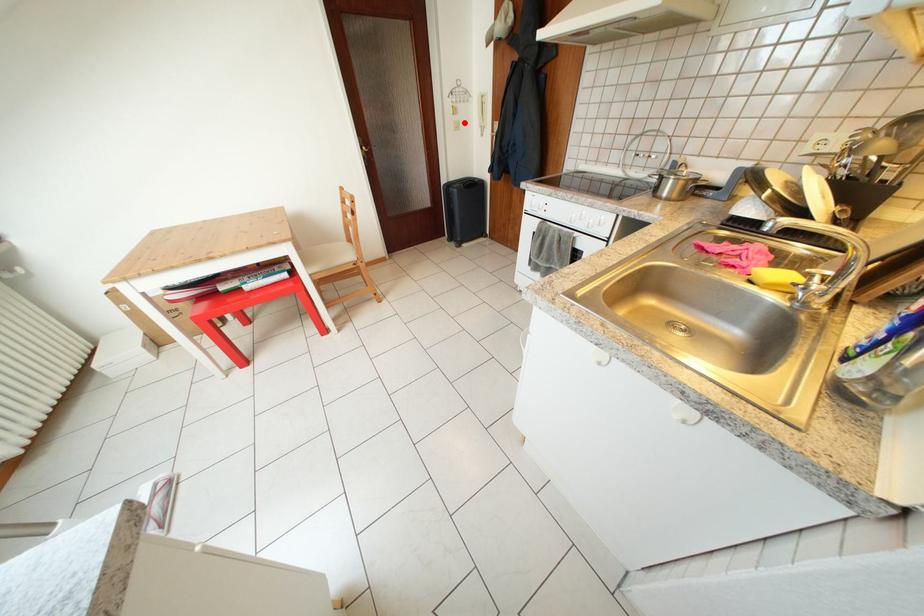
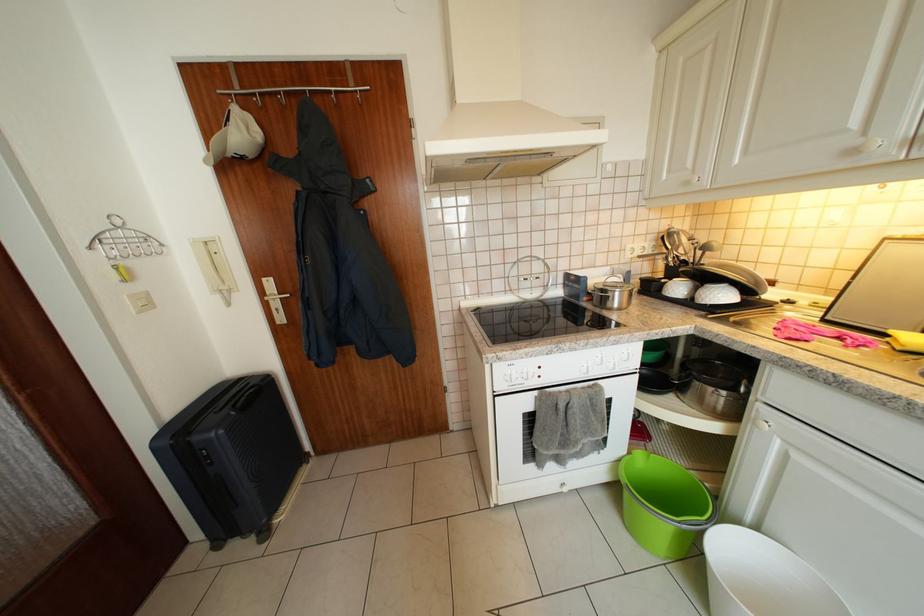
Question: I am providing you with two images of the same scene from different viewpoints. Given a red point in image1, look at the same physical point in image2. Is it:

Choices:
 (A) Closer to the viewpoint
 (B) Farther from the viewpoint

Answer: (B)